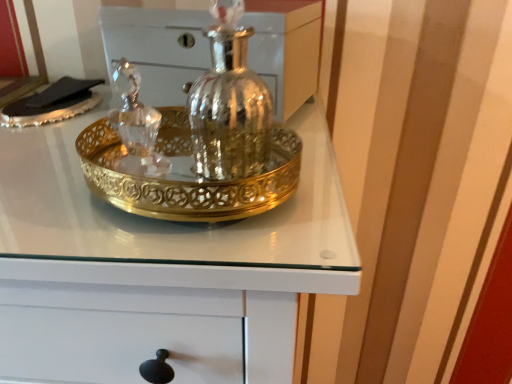
Question: Considering the relative positions of polished silver vase at center and gold metallic tray at center in the image provided, is polished silver vase at center in front of gold metallic tray at center?

Choices:
 (A) no
 (B) yes

Answer: (A)

Question: From a real-world perspective, is polished silver vase at center located higher than gold metallic tray at center?

Choices:
 (A) no
 (B) yes

Answer: (A)

Question: Could gold metallic tray at center be considered to be inside polished silver vase at center?

Choices:
 (A) yes
 (B) no

Answer: (B)

Question: Does polished silver vase at center have a smaller size compared to gold metallic tray at center?

Choices:
 (A) yes
 (B) no

Answer: (A)

Question: Is polished silver vase at center wider than gold metallic tray at center?

Choices:
 (A) yes
 (B) no

Answer: (B)

Question: Can you confirm if polished silver vase at center is positioned to the left of gold metallic tray at center?

Choices:
 (A) no
 (B) yes

Answer: (A)

Question: Does gold metallic tray at center come behind polished silver vase at center?

Choices:
 (A) no
 (B) yes

Answer: (A)

Question: Can you confirm if gold metallic tray at center is shorter than polished silver vase at center?

Choices:
 (A) yes
 (B) no

Answer: (B)

Question: Is the position of gold metallic tray at center less distant than that of polished silver vase at center?

Choices:
 (A) no
 (B) yes

Answer: (B)

Question: Is gold metallic tray at center at the left side of polished silver vase at center?

Choices:
 (A) no
 (B) yes

Answer: (B)

Question: From the image's perspective, is gold metallic tray at center under polished silver vase at center?

Choices:
 (A) yes
 (B) no

Answer: (A)

Question: Can you confirm if gold metallic tray at center is taller than polished silver vase at center?

Choices:
 (A) no
 (B) yes

Answer: (B)

Question: From their relative heights in the image, would you say gold metallic tray at center is taller or shorter than polished silver vase at center?

Choices:
 (A) tall
 (B) short

Answer: (A)